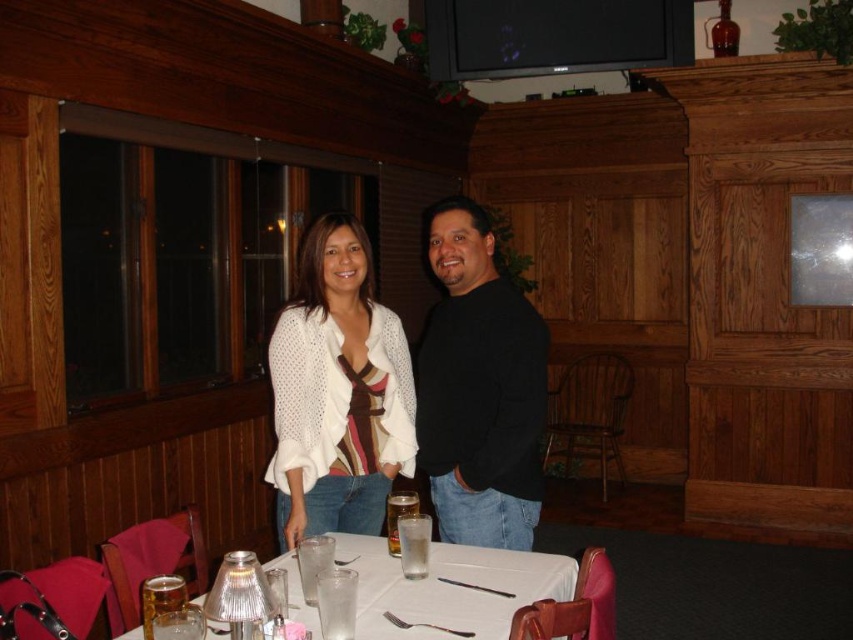
You are a guest at this restaurant and need to choose a place to put your coat. You see the white knit cardigan at center and the black matte sweater at center on the table. Which item is taller and would provide more vertical space for hanging your coat?

The white knit cardigan at center is much taller than the black matte sweater at center, so it would provide more vertical space for hanging your coat.

You are a customer at this restaurant and want to choose a sweater to wear over your outfit. Both the white knit cardigan at center and the black matte sweater at center are available. Which one would you pick if you prefer a larger size?

The white knit cardigan at center has a larger size compared to the black matte sweater at center, so you should choose the white knit cardigan at center.

You are a server in a restaurant and need to deliver a plate to the table. The white knit cardigan at center is blocking your path. Can you reach the white glossy table at center without moving the cardigan?

The white glossy table at center is behind the white knit cardigan at center, so you can reach the white glossy table at center by going around or behind the white knit cardigan at center without moving it.